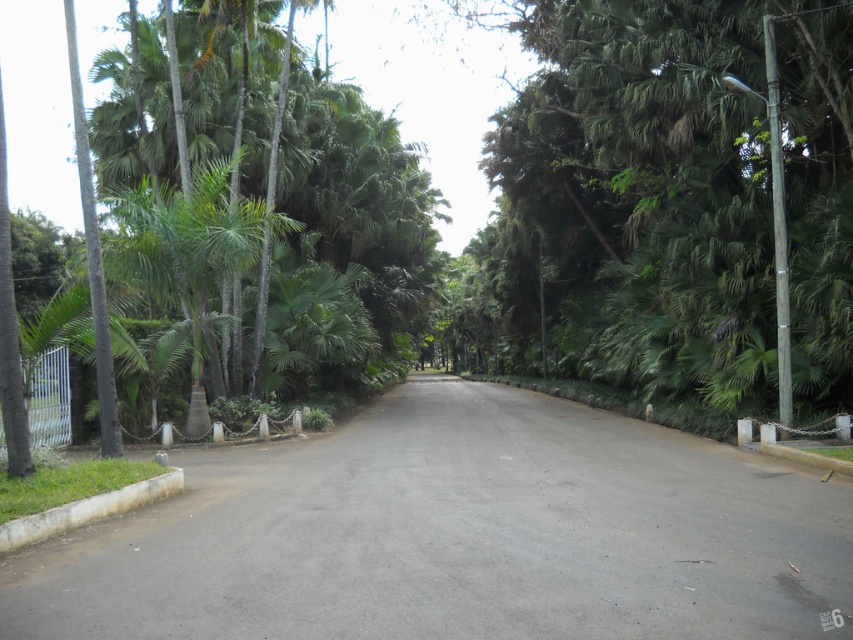
Can you confirm if green leafy tree at center is shorter than green leafy palm at left?

Yes.

You are a GUI agent. You are given a task and a screenshot of the screen. Output one action in this format:
    pyautogui.click(x=<x>, y=<y>)
    Task: Click on the green leafy tree at center
    
    Given the screenshot: What is the action you would take?
    pyautogui.click(x=675, y=202)

Find the location of `green leafy tree at center`. green leafy tree at center is located at coordinates (675, 202).